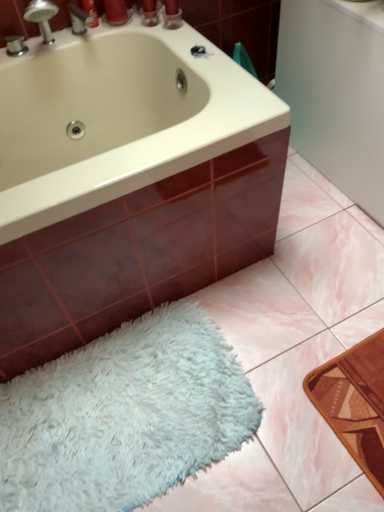
This screenshot has height=512, width=384. What are the coordinates of `vacant area to the left of brushed metal faucet at upper left` in the screenshot? It's located at (42, 52).